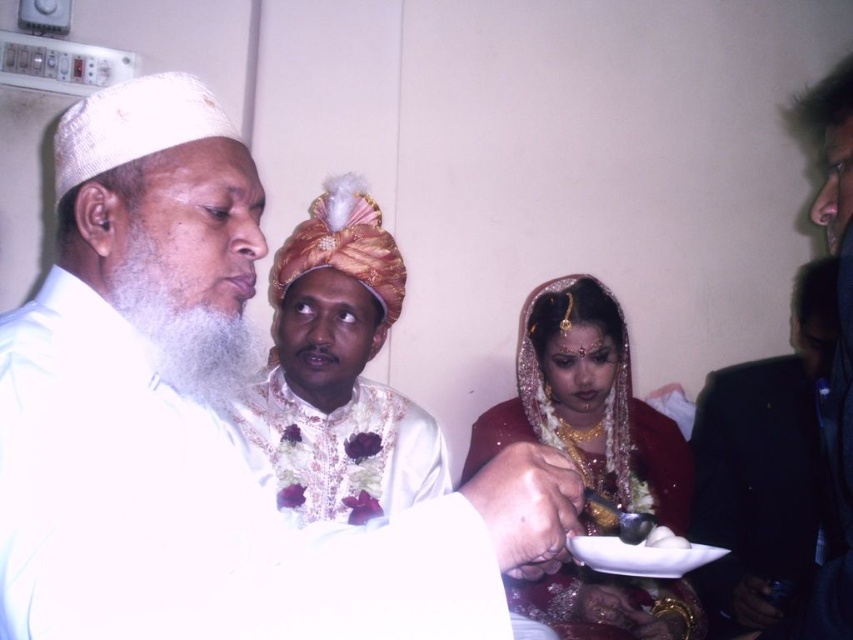
Question: Can you confirm if white satin turban at center is wider than dark blue fabric at right?

Choices:
 (A) no
 (B) yes

Answer: (B)

Question: Can you confirm if white matte turban at upper left is positioned above white glossy rice at lower center?

Choices:
 (A) yes
 (B) no

Answer: (A)

Question: Which of the following is the closest to the observer?

Choices:
 (A) (647, 541)
 (B) (844, 612)
 (C) (357, 432)
 (D) (65, 394)

Answer: (D)

Question: Among these points, which one is nearest to the camera?

Choices:
 (A) (666, 541)
 (B) (164, 147)
 (C) (704, 496)

Answer: (B)

Question: Based on their relative distances, which object is farther from the white satin turban at center?

Choices:
 (A) matte gold jewelry at center
 (B) dark blue fabric at right
 (C) white glossy rice at lower center

Answer: (B)

Question: Does white matte turban at upper left appear over black suit at right?

Choices:
 (A) no
 (B) yes

Answer: (B)